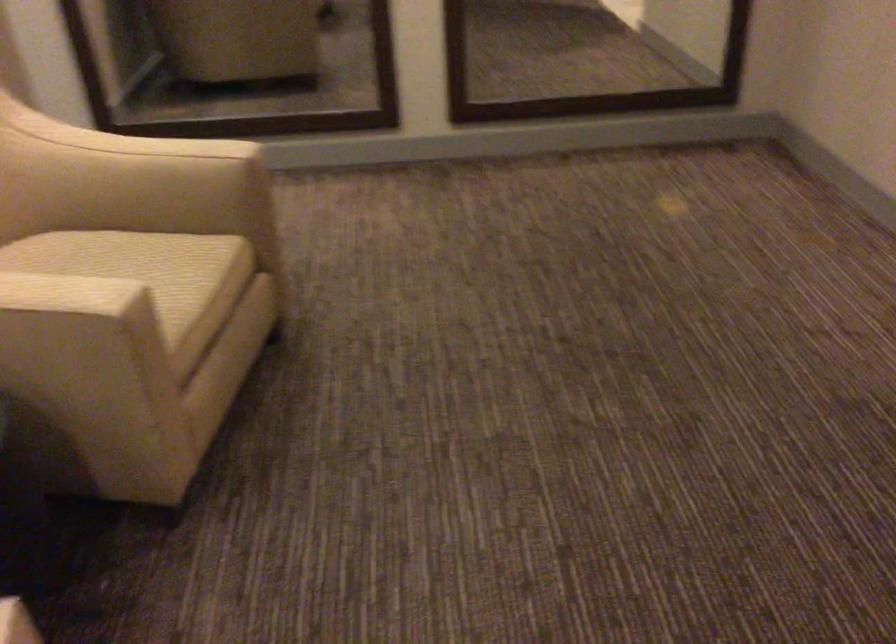
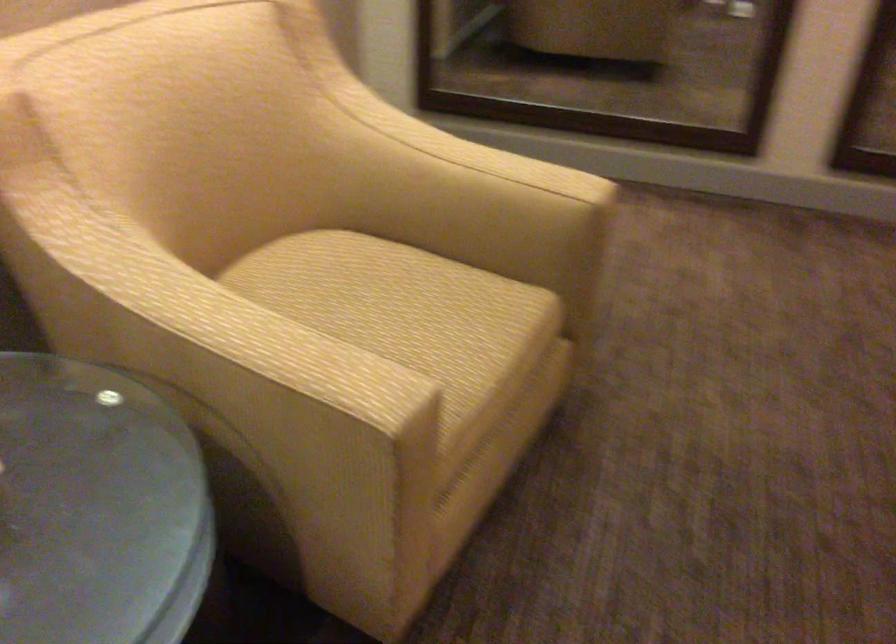
The images are taken continuously from a first-person perspective. In which direction are you moving?

The cameraman walked toward left, forward.